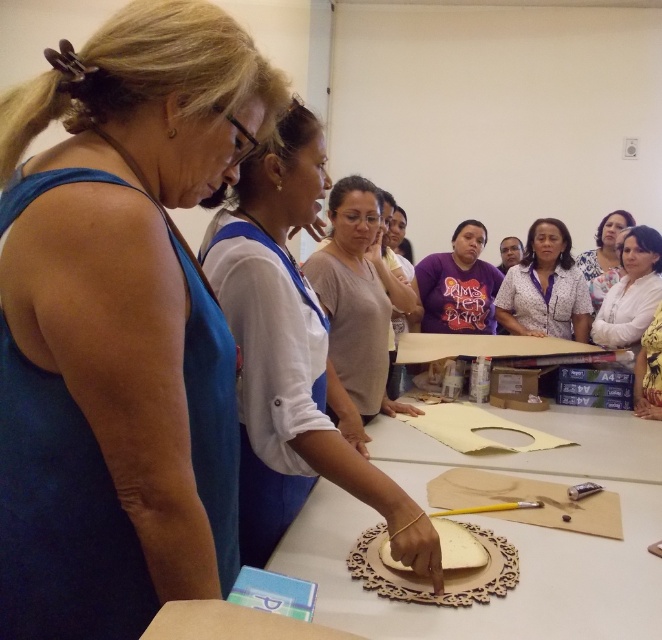
Question: Which point is closer to the camera?

Choices:
 (A) [x=451, y=266]
 (B) [x=273, y=138]
 (C) [x=616, y=298]
 (D) [x=596, y=250]

Answer: (B)

Question: Which of these objects is positioned closest to the blue fabric at left?

Choices:
 (A) white dotted blouse at center
 (B) white textured blouse at upper center
 (C) white fabric at upper center

Answer: (B)

Question: Is white matte shirt at upper center wider than white fabric at upper center?

Choices:
 (A) no
 (B) yes

Answer: (A)

Question: Is blue fabric at left bigger than white fabric at upper center?

Choices:
 (A) no
 (B) yes

Answer: (B)

Question: Is white textured blouse at upper center in front of white matte shirt at upper center?

Choices:
 (A) no
 (B) yes

Answer: (A)

Question: Which of the following is the closest to the observer?

Choices:
 (A) (506, 320)
 (B) (600, 268)
 (C) (322, 188)
 (D) (651, 352)

Answer: (C)